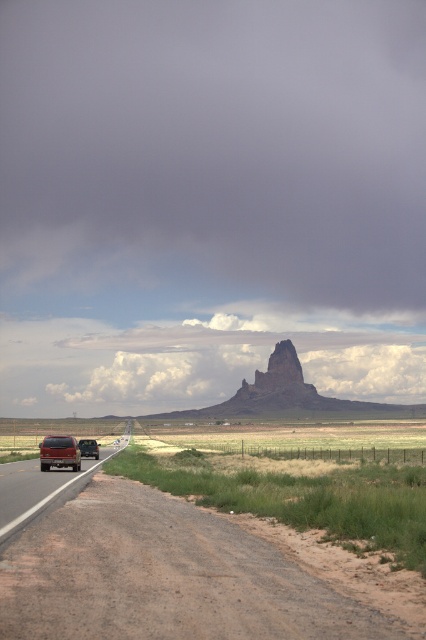
Does smooth asphalt highway at center appear on the right side of rugged rock formation at center?

No, smooth asphalt highway at center is not to the right of rugged rock formation at center.

Measure the distance between smooth asphalt highway at center and camera.

They are 19.23 feet apart.

This screenshot has height=640, width=426. What do you see at coordinates (192, 576) in the screenshot?
I see `smooth asphalt highway at center` at bounding box center [192, 576].

The width and height of the screenshot is (426, 640). What are the coordinates of `smooth asphalt highway at center` in the screenshot? It's located at (192, 576).

Does rugged rock formation at center have a greater width compared to matte red car at left?

Indeed, rugged rock formation at center has a greater width compared to matte red car at left.

Which of these two, rugged rock formation at center or matte red car at left, stands shorter?

matte red car at left

Which is in front, point (301, 392) or point (20, 477)?

Point (20, 477)

This screenshot has width=426, height=640. I want to click on rugged rock formation at center, so click(287, 396).

Does dark gray cloud at upper center appear on the right side of matte red car at left?

Yes, dark gray cloud at upper center is to the right of matte red car at left.

Is dark gray cloud at upper center below matte red car at left?

Incorrect, dark gray cloud at upper center is not positioned below matte red car at left.

Does point (391, 308) come farther from viewer compared to point (57, 497)?

Yes, it is.

Image resolution: width=426 pixels, height=640 pixels. What are the coordinates of `dark gray cloud at upper center` in the screenshot? It's located at click(212, 154).